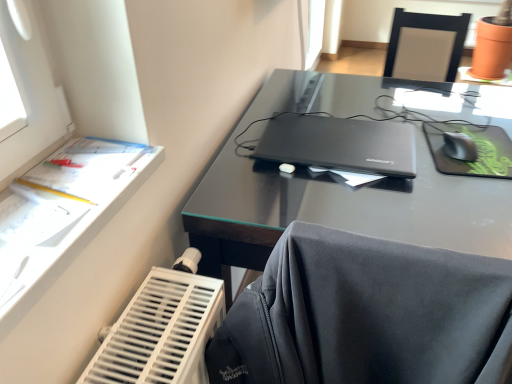
Where is `vacant space to the left of black plastic mouse at right`? vacant space to the left of black plastic mouse at right is located at coordinates (413, 154).